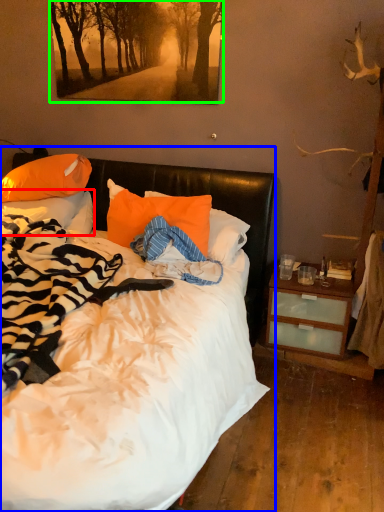
Question: Which is farther away from pillow (highlighted by a red box)? bed (highlighted by a blue box) or tree (highlighted by a green box)?

Choices:
 (A) bed
 (B) tree

Answer: (A)